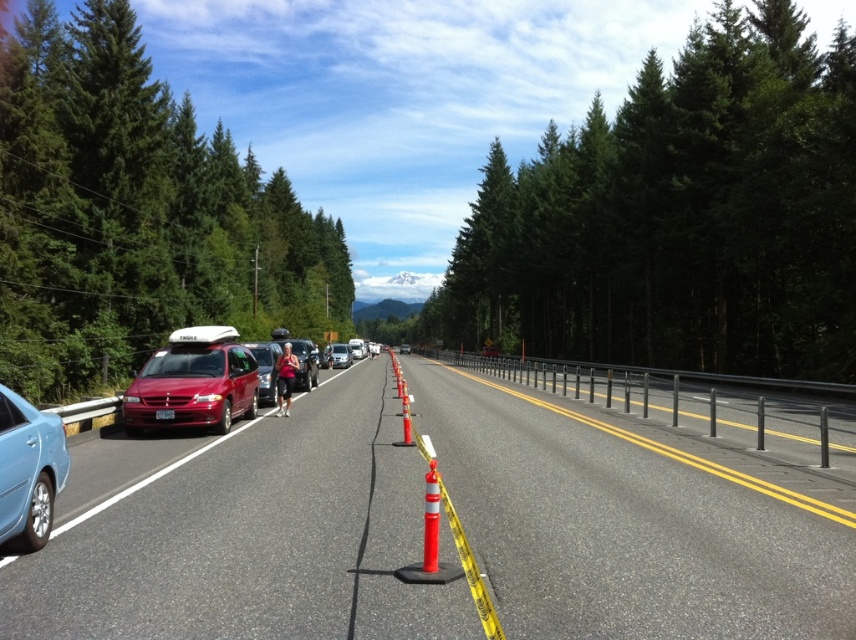
Can you confirm if light blue metallic sedan at lower left is smaller than matte silver van at center?

Yes, light blue metallic sedan at lower left is smaller than matte silver van at center.

Can you confirm if light blue metallic sedan at lower left is positioned above matte silver van at center?

Indeed, light blue metallic sedan at lower left is positioned over matte silver van at center.

Between point (42, 545) and point (333, 356), which one is positioned in front?

Point (42, 545) is in front.

At what (x,y) coordinates should I click in order to perform the action: click on light blue metallic sedan at lower left. Please return your answer as a coordinate pair (x, y). The image size is (856, 640). Looking at the image, I should click on (28, 472).

Which of these two, smooth asphalt highway at center or matte silver van at center, stands shorter?

Standing shorter between the two is smooth asphalt highway at center.

Does point (545, 417) lie behind point (339, 356)?

No, it is in front of (339, 356).

Where is `smooth asphalt highway at center`? smooth asphalt highway at center is located at coordinates (245, 532).

You are a GUI agent. You are given a task and a screenshot of the screen. Output one action in this format:
    pyautogui.click(x=<x>, y=<y>)
    Task: Click on the smooth asphalt highway at center
    
    Given the screenshot: What is the action you would take?
    pyautogui.click(x=245, y=532)

Between green leafy trees at center and green leafy tree at left, which one appears on the right side from the viewer's perspective?

Positioned to the right is green leafy trees at center.

Does point (525, 198) come closer to viewer compared to point (120, 228)?

No.

Is point (835, 333) farther from camera compared to point (46, 182)?

No, it is not.

Identify the location of green leafy trees at center. The width and height of the screenshot is (856, 640). (678, 216).